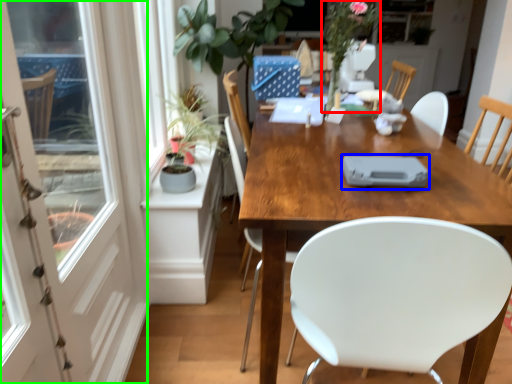
Question: Which object is the closest to the floral arrangement (highlighted by a red box)? Choose among these: tableware (highlighted by a blue box) or screen door (highlighted by a green box).

Choices:
 (A) tableware
 (B) screen door

Answer: (A)